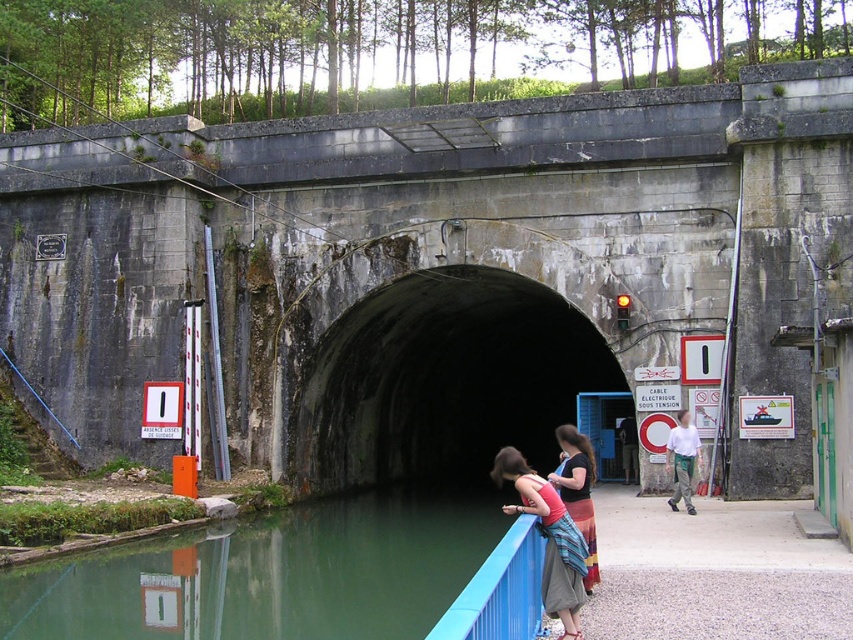
At what (x,y) coordinates should I click in order to perform the action: click on dark concrete tunnel at center. Please return your answer as a coordinate pair (x, y). This screenshot has width=853, height=640. Looking at the image, I should click on (440, 380).

Is dark concrete tunnel at center to the right of black fabric skirt at lower center from the viewer's perspective?

Incorrect, dark concrete tunnel at center is not on the right side of black fabric skirt at lower center.

Between point (461, 324) and point (575, 476), which one is positioned behind?

Positioned behind is point (461, 324).

Find the location of a particular element. dark concrete tunnel at center is located at coordinates (440, 380).

Does concrete bridge at center have a smaller size compared to matte pink tank top at center?

No.

Is point (126, 342) farther from camera compared to point (547, 570)?

Yes.

The height and width of the screenshot is (640, 853). What do you see at coordinates (434, 266) in the screenshot?
I see `concrete bridge at center` at bounding box center [434, 266].

At what (x,y) coordinates should I click in order to perform the action: click on concrete bridge at center. Please return your answer as a coordinate pair (x, y). The height and width of the screenshot is (640, 853). Looking at the image, I should click on (434, 266).

Consider the image. Does green smooth water at lower left have a greater height compared to matte pink tank top at center?

In fact, green smooth water at lower left may be shorter than matte pink tank top at center.

Who is lower down, green smooth water at lower left or matte pink tank top at center?

green smooth water at lower left is below.

Measure the distance between green smooth water at lower left and camera.

14.71 meters

Where is `green smooth water at lower left`? This screenshot has height=640, width=853. green smooth water at lower left is located at coordinates (299, 577).